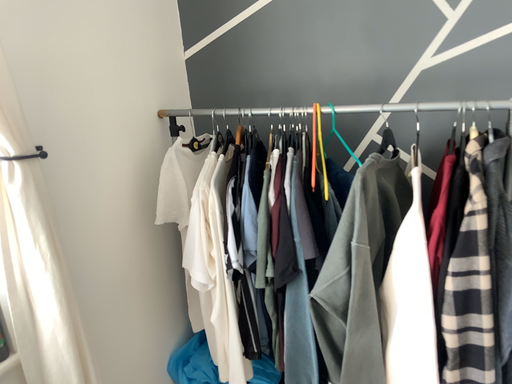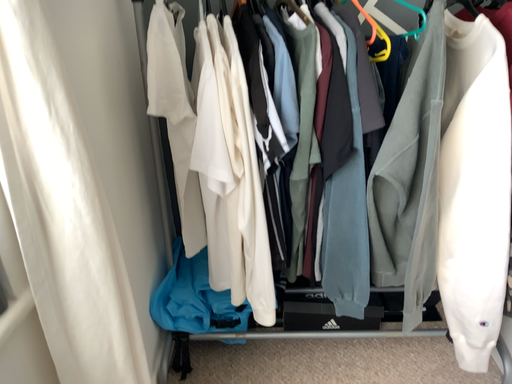
Question: How did the camera likely rotate when shooting the video?

Choices:
 (A) rotated left
 (B) rotated right

Answer: (B)